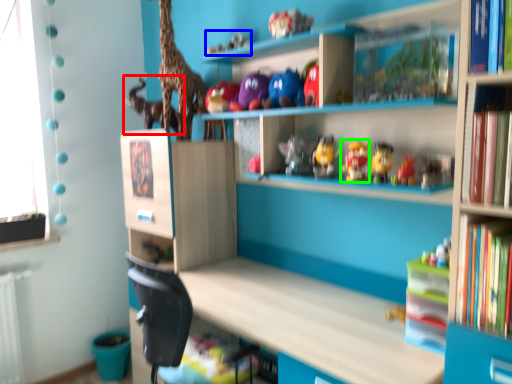
Question: Based on their relative distances, which object is farther from animal (highlighted by a red box)? Choose from toy (highlighted by a blue box) and toy (highlighted by a green box).

Choices:
 (A) toy
 (B) toy

Answer: (B)